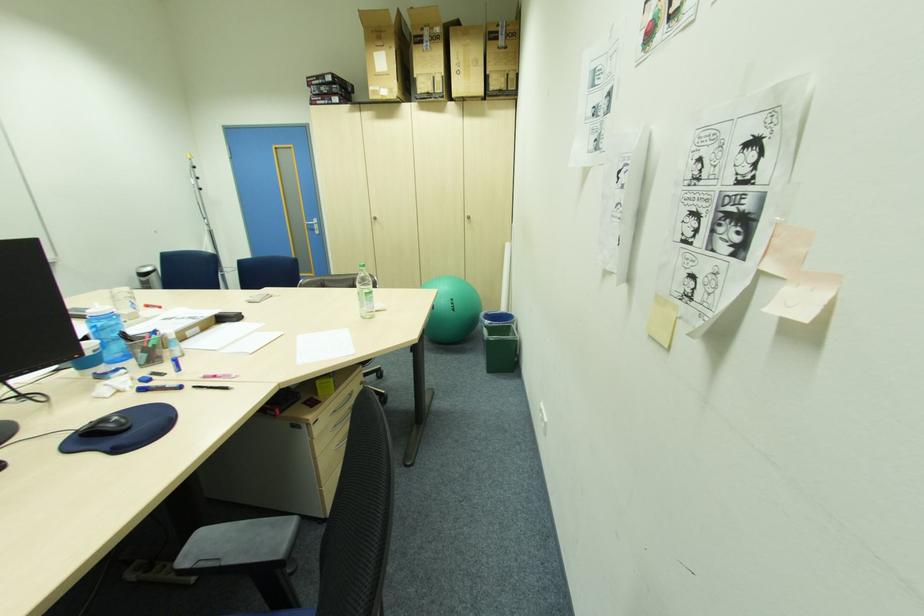
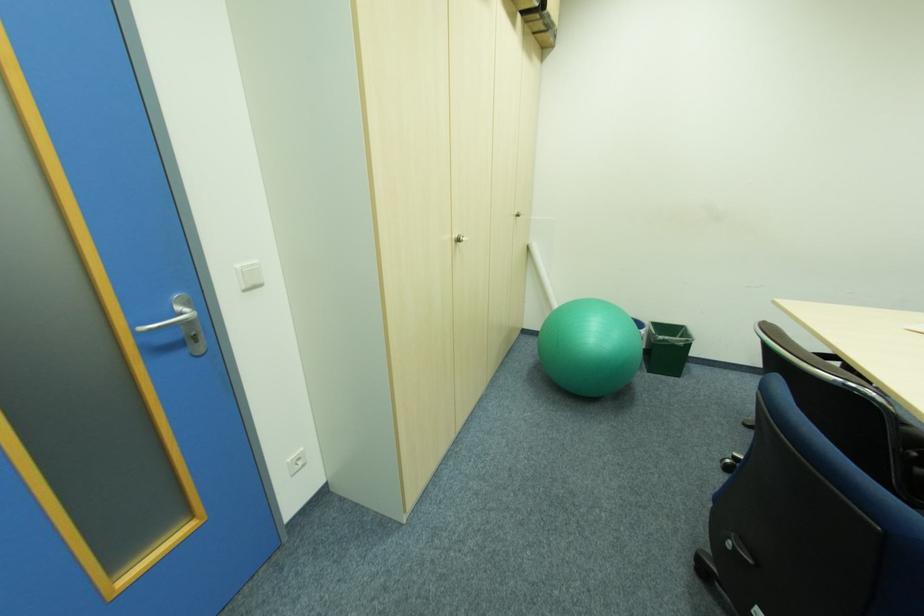
Find the pixel in the second image that matches point 322,230 in the first image.

(200, 339)